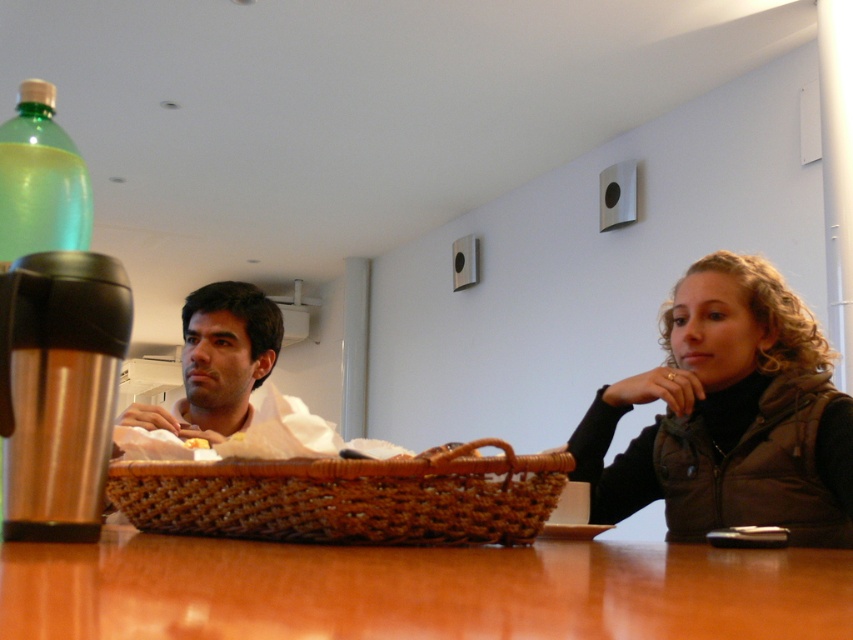
Does shiny brown table at center appear over brown textured vest at right?

Incorrect, shiny brown table at center is not positioned above brown textured vest at right.

What do you see at coordinates (416, 589) in the screenshot? This screenshot has width=853, height=640. I see `shiny brown table at center` at bounding box center [416, 589].

This screenshot has height=640, width=853. I want to click on shiny brown table at center, so click(416, 589).

This screenshot has height=640, width=853. In order to click on shiny brown table at center in this screenshot , I will do `click(416, 589)`.

From the picture: Between brown textured vest at right and woven brown basket at center, which one has more height?

brown textured vest at right is taller.

Does point (840, 474) lie in front of point (300, 513)?

No, it is behind (300, 513).

Identify the location of brown textured vest at right. (729, 417).

Does shiny brown table at center appear under yellow soft bread at center?

Yes.

This screenshot has height=640, width=853. What do you see at coordinates (416, 589) in the screenshot?
I see `shiny brown table at center` at bounding box center [416, 589].

Where is `shiny brown table at center`? Image resolution: width=853 pixels, height=640 pixels. shiny brown table at center is located at coordinates pos(416,589).